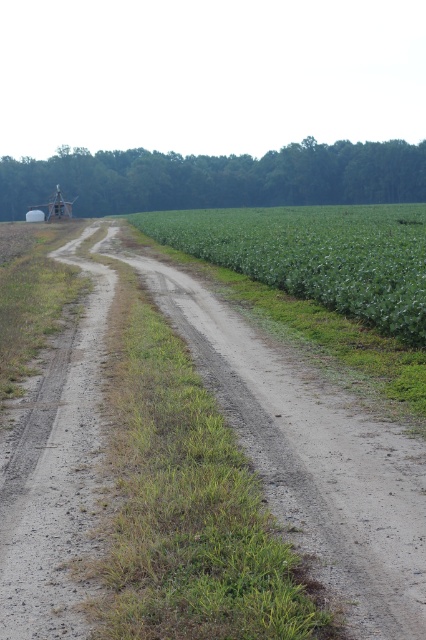
Question: Is dusty gravel road at center closer to camera compared to green leafy corn field at center?

Choices:
 (A) yes
 (B) no

Answer: (A)

Question: Which of the following is the farthest from the observer?

Choices:
 (A) dusty gravel road at center
 (B) green leafy corn field at center

Answer: (B)

Question: Does dusty gravel road at center appear on the right side of green leafy corn field at center?

Choices:
 (A) no
 (B) yes

Answer: (A)

Question: Does dusty gravel road at center lie behind green leafy corn field at center?

Choices:
 (A) no
 (B) yes

Answer: (A)